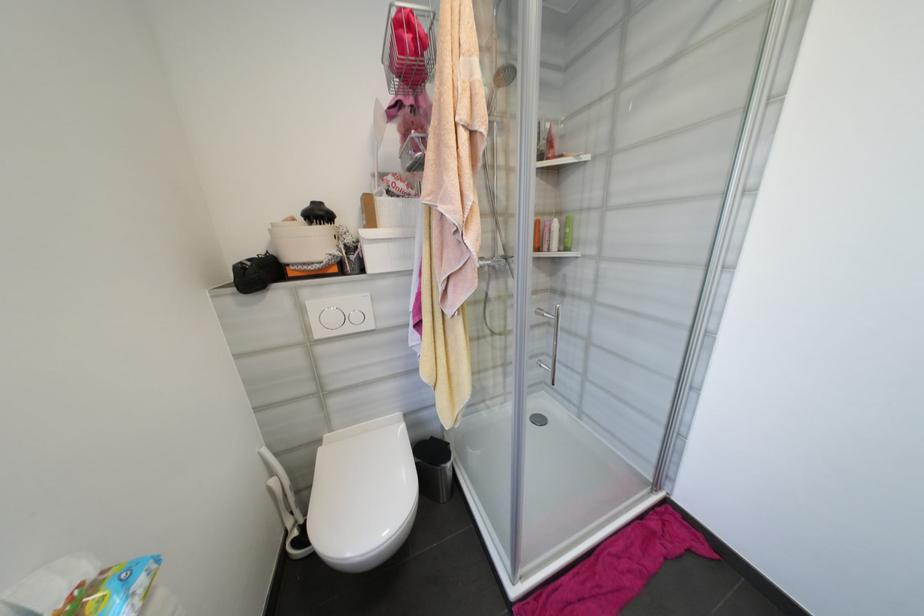
What do you see at coordinates (356, 317) in the screenshot? I see `a small flush button` at bounding box center [356, 317].